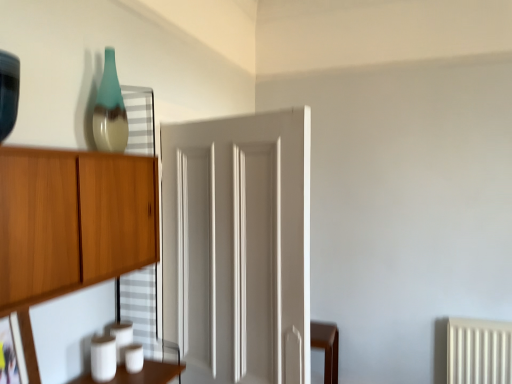
Question: Is teal glass vase at upper left taller or shorter than matte black picture frame at lower left?

Choices:
 (A) short
 (B) tall

Answer: (B)

Question: Looking at their shapes, would you say teal glass vase at upper left is wider or thinner than matte black picture frame at lower left?

Choices:
 (A) wide
 (B) thin

Answer: (A)

Question: Which of these objects is positioned farthest from the teal glass vase at upper left?

Choices:
 (A) white painted wood door at center
 (B) matte black picture frame at lower left

Answer: (B)

Question: Which object is the closest to the teal glass vase at upper left?

Choices:
 (A) matte black picture frame at lower left
 (B) white painted wood door at center

Answer: (B)